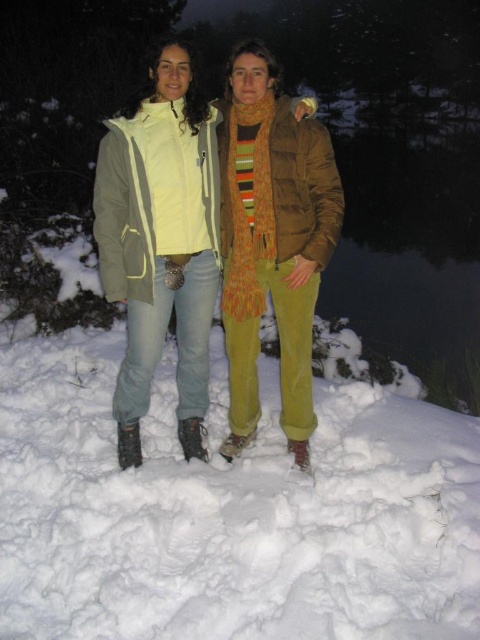
Question: Is the position of matte yellow jacket at center more distant than that of brown suede jacket at center?

Choices:
 (A) no
 (B) yes

Answer: (A)

Question: Is matte yellow jacket at center smaller than brown suede jacket at center?

Choices:
 (A) no
 (B) yes

Answer: (A)

Question: Among these objects, which one is nearest to the camera?

Choices:
 (A) matte yellow jacket at center
 (B) brown suede jacket at center

Answer: (A)

Question: Does matte yellow jacket at center appear under brown suede jacket at center?

Choices:
 (A) no
 (B) yes

Answer: (B)

Question: Which point is farther to the camera?

Choices:
 (A) (113, 236)
 (B) (228, 128)

Answer: (B)